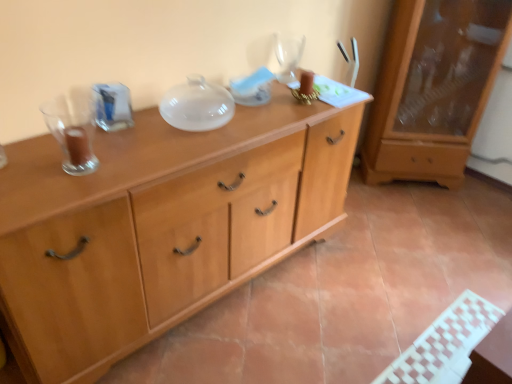
Question: In the image, is light wood cabinet at center on the left side or the right side of transparent glass wine glass at upper center?

Choices:
 (A) right
 (B) left

Answer: (B)

Question: Is point (143, 299) positioned closer to the camera than point (288, 59)?

Choices:
 (A) closer
 (B) farther

Answer: (A)

Question: Which object is the closest to the transparent glass wine glass at upper center?

Choices:
 (A) matte wooden cabinet at right
 (B) light wood cabinet at center

Answer: (B)

Question: Estimate the real-world distances between objects in this image. Which object is closer to the transparent glass wine glass at upper center?

Choices:
 (A) matte wooden cabinet at right
 (B) light wood cabinet at center

Answer: (B)